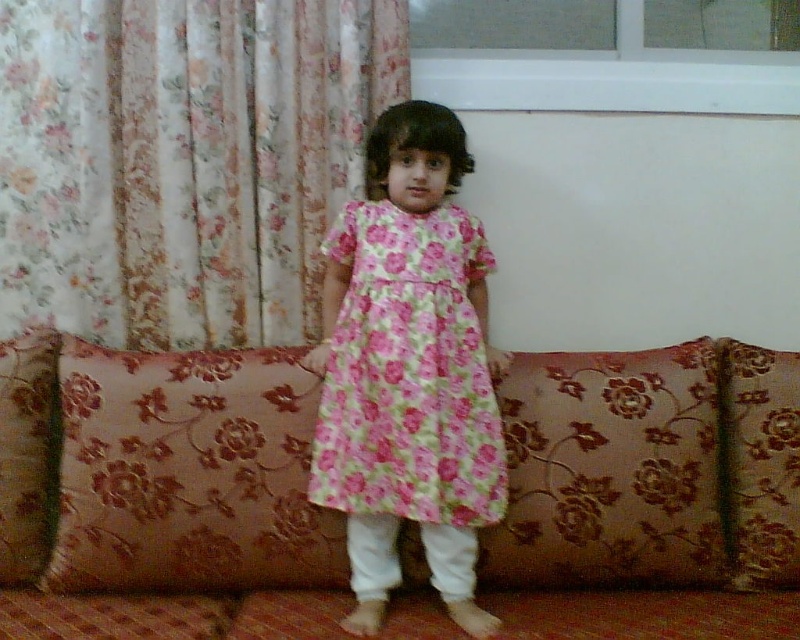
Based on the photo, you are a decorator trying to arrange two floral fabric pillows on a sofa. The pillows are the floral fabric pillow at center and the floral fabric pillow at left. The distance between them is 4.65 feet. If you want to place a new decorative vase between them, what is the minimum width the vase should have to fit without overlapping the pillows?

The minimum width the vase should have is 4.65 feet to fit between the floral fabric pillow at center and the floral fabric pillow at left without overlapping them.

The child is wearing a floral cotton dress at center and standing on a floral fabric pillow at left. Which item is positioned higher relative to the other?

The floral cotton dress at center is above the floral fabric pillow at left, so the dress is higher than the pillow.